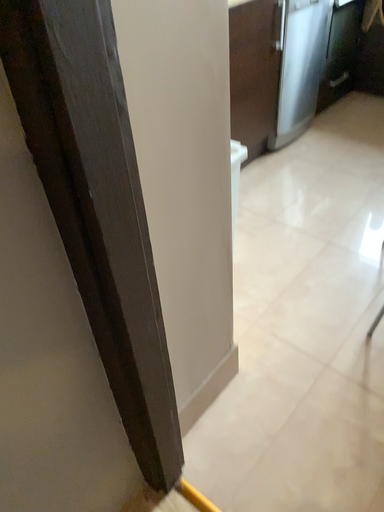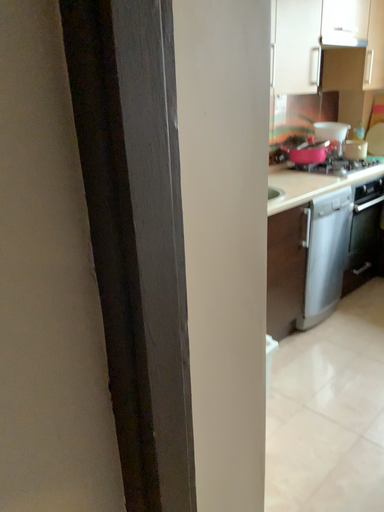
Question: How did the camera likely rotate when shooting the video?

Choices:
 (A) rotated upward
 (B) rotated downward

Answer: (A)